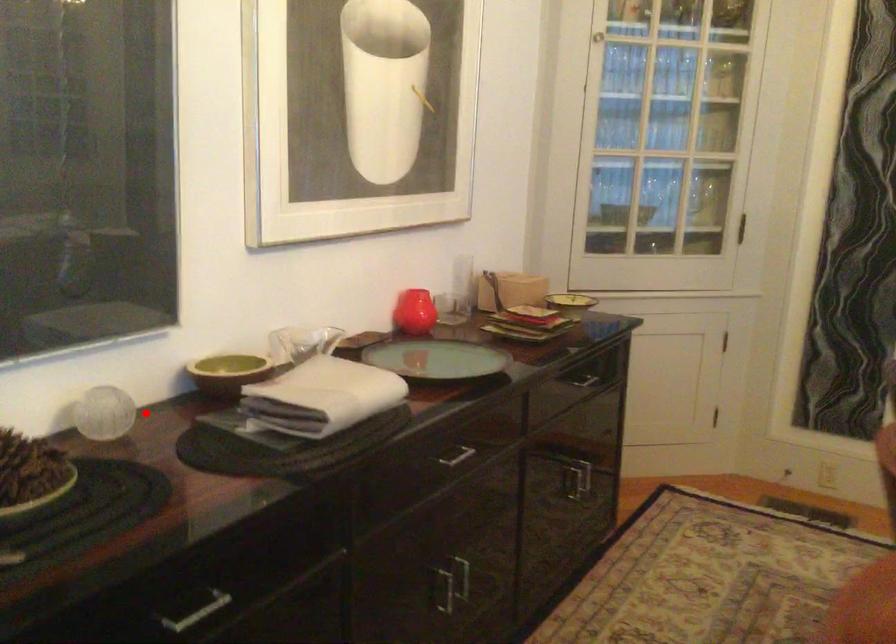
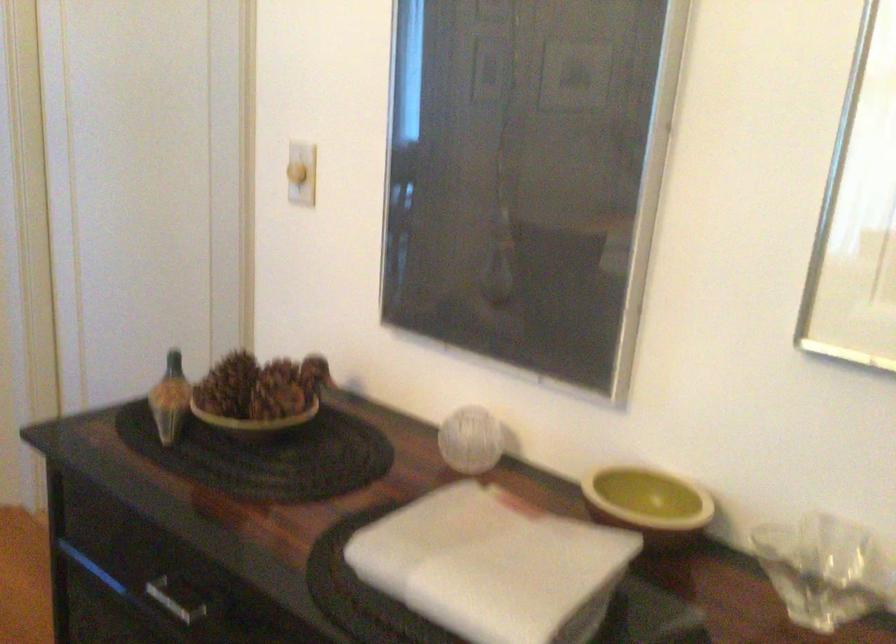
Locate, in the second image, the point that corresponds to the highlighted location in the first image.

(470, 440)